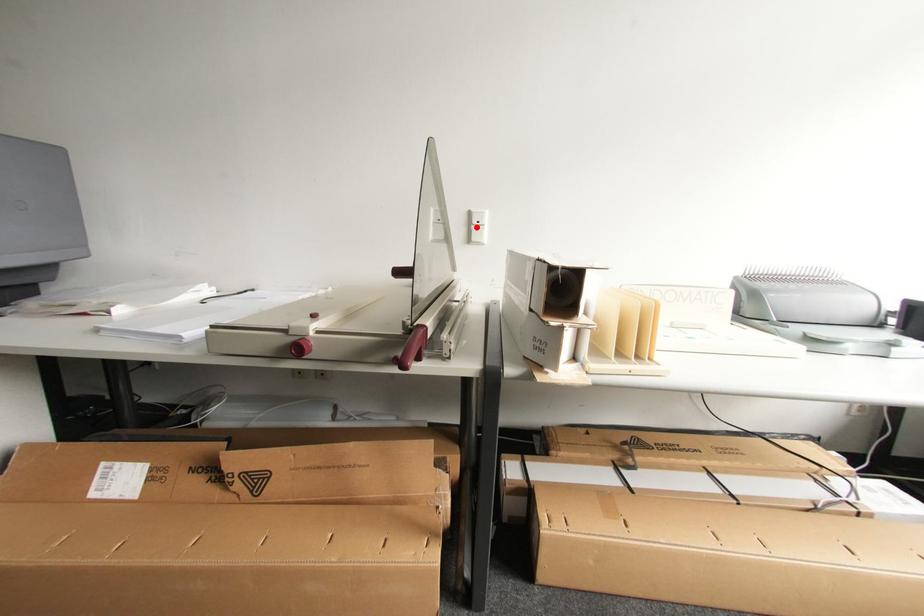
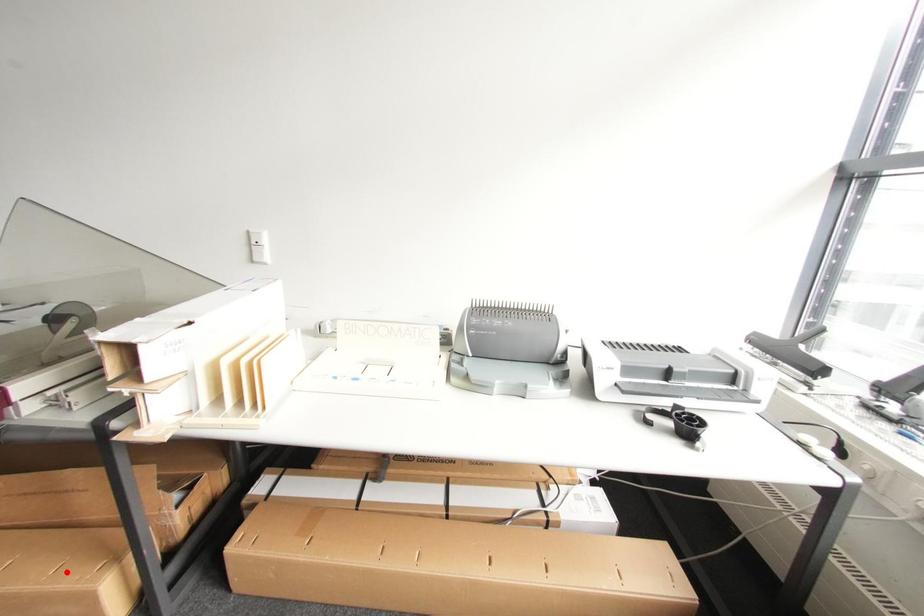
I am providing you with two images of the same scene from different viewpoints. A red point is marked on the first image and another point is marked on the second image. Is the marked point in image1 the same physical position as the marked point in image2?

No